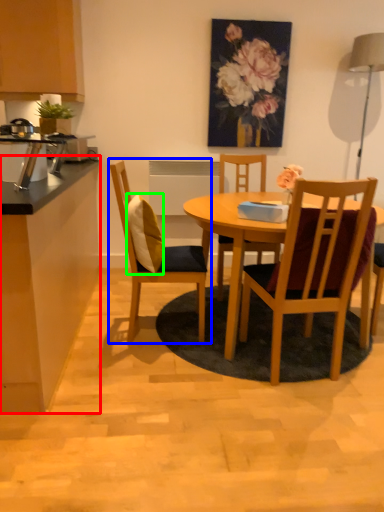
Question: Considering the real-world distances, which object is closest to counter top (highlighted by a red box)? chair (highlighted by a blue box) or pillow (highlighted by a green box).

Choices:
 (A) chair
 (B) pillow

Answer: (A)